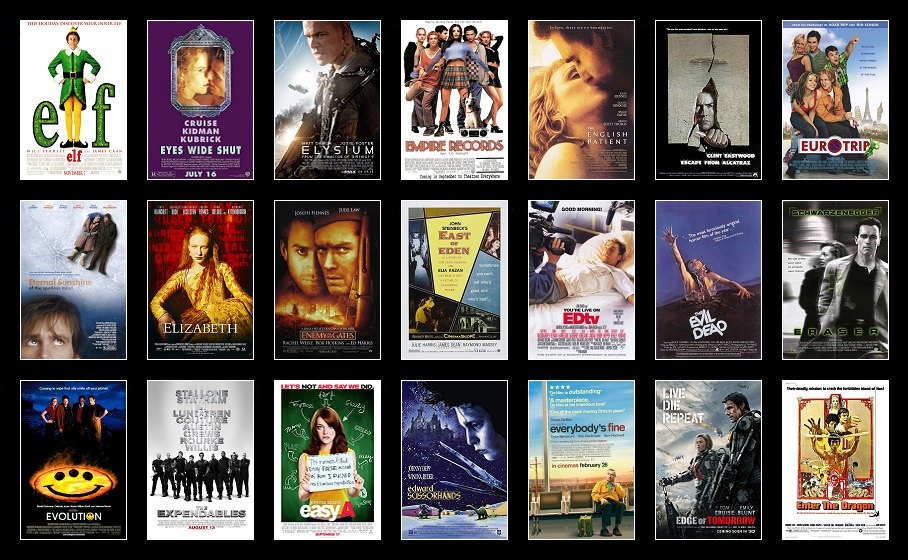
You are a GUI agent. You are given a task and a screenshot of the screen. Output one action in this format:
    pyautogui.click(x=<x>, y=<y>)
    Task: Click on the posters in the top row
    The image size is (908, 560).
    Given the screenshot: What is the action you would take?
    pyautogui.click(x=85, y=80), pyautogui.click(x=196, y=93), pyautogui.click(x=337, y=97), pyautogui.click(x=436, y=100), pyautogui.click(x=574, y=104), pyautogui.click(x=724, y=105), pyautogui.click(x=813, y=109)